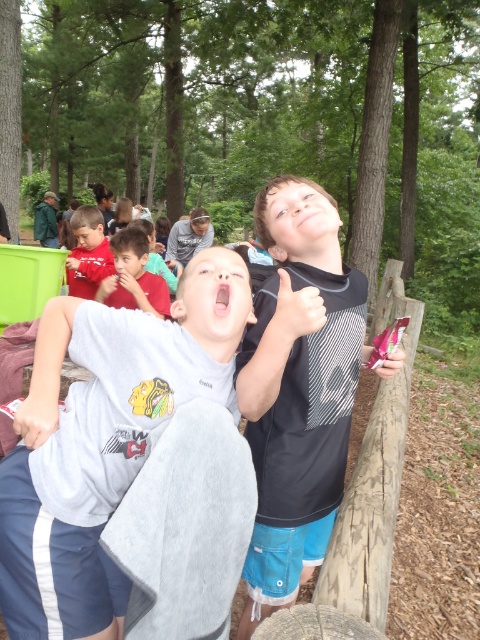
You are a photographer trying to capture both the gray cotton shirt at center and the matte red shirt at upper left in a single frame. Which shirt should you focus on to ensure both are visible without cropping?

You should focus on the matte red shirt at upper left because it occupies more space, allowing the smaller gray cotton shirt at center to fit into the frame without cropping.